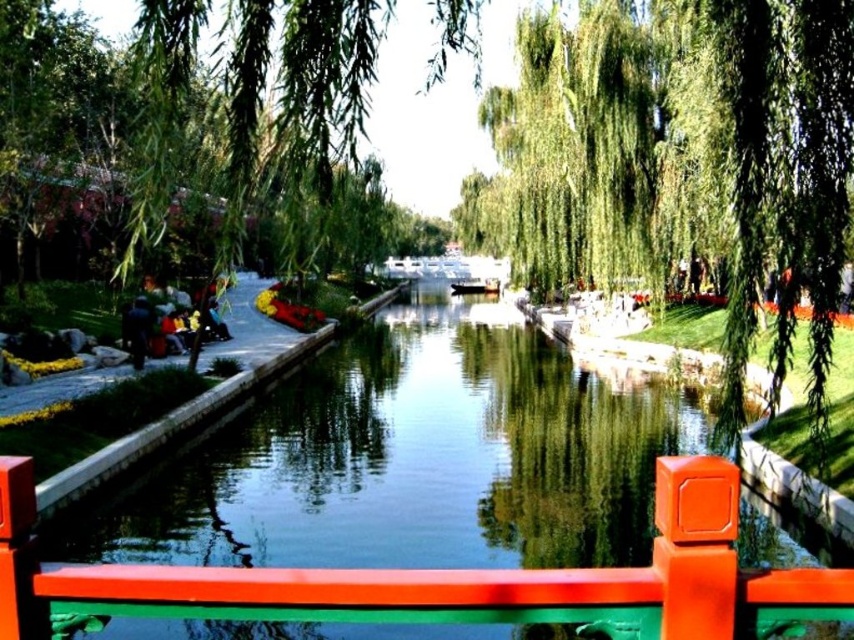
Question: Does green smooth water at center lie behind green leafy willow at upper center?

Choices:
 (A) yes
 (B) no

Answer: (B)

Question: Which point appears farthest from the camera in this image?

Choices:
 (A) (542, 106)
 (B) (475, 534)

Answer: (A)

Question: Which is nearer to the green smooth water at center?

Choices:
 (A) green leafy willow at upper center
 (B) green leafy willow at center

Answer: (B)

Question: Does green smooth water at center lie in front of green leafy willow at upper center?

Choices:
 (A) yes
 (B) no

Answer: (A)

Question: Among these objects, which one is farthest from the camera?

Choices:
 (A) green smooth water at center
 (B) green leafy willow at center
 (C) green leafy willow at upper center

Answer: (C)

Question: Is green smooth water at center below green leafy willow at upper center?

Choices:
 (A) yes
 (B) no

Answer: (A)